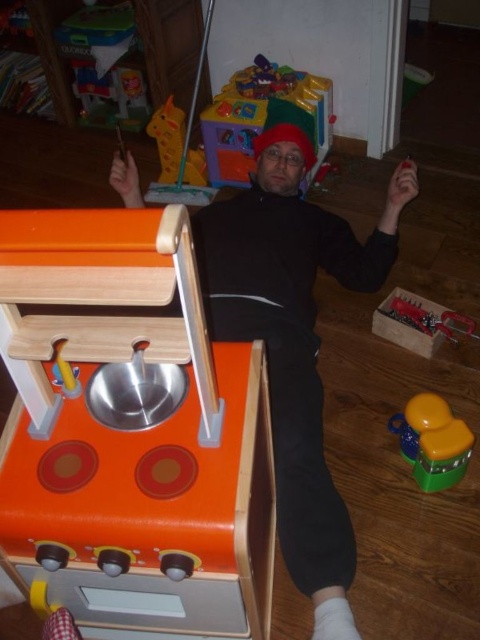
Which of these two, black matte clothing at center or translucent green toy at lower right, stands taller?

black matte clothing at center is taller.

Can you confirm if black matte clothing at center is positioned below translucent green toy at lower right?

Actually, black matte clothing at center is above translucent green toy at lower right.

Image resolution: width=480 pixels, height=640 pixels. Find the location of `black matte clothing at center`. black matte clothing at center is located at coordinates (295, 333).